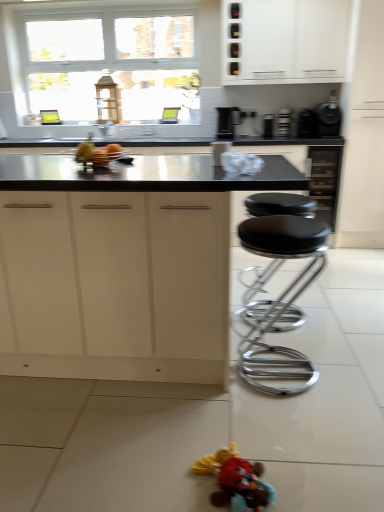
Question: Is black plastic toaster at upper right, which appears as the 2th appliance when viewed from the right, outside of black chrome stool at center?

Choices:
 (A) yes
 (B) no

Answer: (A)

Question: Is black plastic toaster at upper right, which appears as the 2th appliance when viewed from the right, to the right of black chrome stool at center from the viewer's perspective?

Choices:
 (A) no
 (B) yes

Answer: (B)

Question: Considering the relative sizes of black plastic toaster at upper right, acting as the 4th appliance starting from the left, and black chrome stool at center in the image provided, is black plastic toaster at upper right, acting as the 4th appliance starting from the left, thinner than black chrome stool at center?

Choices:
 (A) yes
 (B) no

Answer: (A)

Question: From the image's perspective, is black plastic toaster at upper right, which appears as the 2th appliance when viewed from the right, located beneath black chrome stool at center?

Choices:
 (A) no
 (B) yes

Answer: (A)

Question: Does black plastic toaster at upper right, acting as the 4th appliance starting from the left, lie in front of black chrome stool at center?

Choices:
 (A) no
 (B) yes

Answer: (A)

Question: Based on their sizes in the image, would you say black plastic coffee machine at upper center is bigger or smaller than black plastic toaster at upper center, placed as the 2th appliance when sorted from left to right?

Choices:
 (A) small
 (B) big

Answer: (B)

Question: Considering the positions of point (233, 130) and point (269, 124), is point (233, 130) closer or farther from the camera than point (269, 124)?

Choices:
 (A) farther
 (B) closer

Answer: (A)

Question: From a real-world perspective, is black plastic coffee machine at upper center positioned above or below black plastic toaster at upper center, the fourth appliance from the right?

Choices:
 (A) above
 (B) below

Answer: (A)

Question: Looking at their shapes, would you say black plastic coffee machine at upper center is wider or thinner than black plastic toaster at upper center, the fourth appliance from the right?

Choices:
 (A) thin
 (B) wide

Answer: (B)

Question: Is black plastic toaster at upper center, which appears as the third appliance when viewed from the right, bigger or smaller than black chrome stool at center?

Choices:
 (A) small
 (B) big

Answer: (A)

Question: From a real-world perspective, is black plastic toaster at upper center, which is the 3th appliance in left-to-right order, above or below black chrome stool at center?

Choices:
 (A) below
 (B) above

Answer: (B)

Question: From the image's perspective, is black plastic toaster at upper center, which appears as the third appliance when viewed from the right, above or below black chrome stool at center?

Choices:
 (A) above
 (B) below

Answer: (A)

Question: Do you think black plastic toaster at upper center, which is the 3th appliance in left-to-right order, is within black chrome stool at center, or outside of it?

Choices:
 (A) inside
 (B) outside

Answer: (B)

Question: Is black chrome stool at center bigger or smaller than white matte cabinet at upper center, arranged as the first cabinetry when viewed from the back?

Choices:
 (A) small
 (B) big

Answer: (A)

Question: From the image's perspective, is black chrome stool at center positioned above or below white matte cabinet at upper center, arranged as the 1th cabinetry when viewed from the top?

Choices:
 (A) below
 (B) above

Answer: (A)